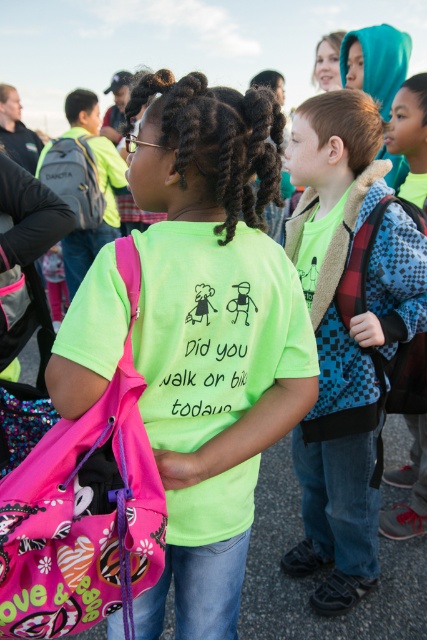
Does checkered fabric backpack at center appear under green matte pigtail at center?

Correct, checkered fabric backpack at center is located below green matte pigtail at center.

Which is in front, point (347, 358) or point (166, 138)?

Point (166, 138) is more forward.

The width and height of the screenshot is (427, 640). Describe the element at coordinates (345, 336) in the screenshot. I see `checkered fabric backpack at center` at that location.

Image resolution: width=427 pixels, height=640 pixels. What are the coordinates of `checkered fabric backpack at center` in the screenshot? It's located at (345, 336).

Who is higher up, neon green t-shirt at center or checkered fabric backpack at center?

checkered fabric backpack at center

Who is positioned more to the left, neon green t-shirt at center or checkered fabric backpack at center?

neon green t-shirt at center

Who is more forward, (228,348) or (408,250)?

Point (228,348) is more forward.

Where is `neon green t-shirt at center`? This screenshot has width=427, height=640. neon green t-shirt at center is located at coordinates (211, 333).

Measure the distance between point (219, 198) and camera.

They are 1.53 meters apart.

Identify the location of neon green t-shirt at center. This screenshot has height=640, width=427. (211, 333).